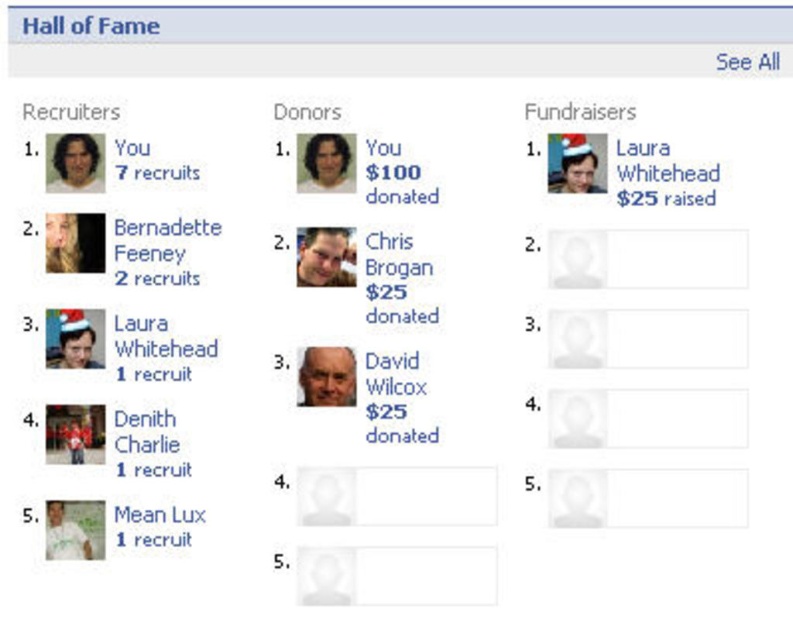
Does matte black face at upper left lie in front of matte plastic face at upper center?

Yes.

Can you confirm if matte black face at upper left is positioned to the right of matte plastic face at upper center?

No, matte black face at upper left is not to the right of matte plastic face at upper center.

Identify the location of matte black face at upper left. (75, 160).

Locate an element on the screen. This screenshot has height=640, width=793. matte black face at upper left is located at coordinates (75, 160).

Is point (83, 332) farther from viewer compared to point (585, 161)?

No, (83, 332) is closer to viewer.

Which of these two, matte black face at center or matte plastic face at upper center, stands shorter?

Standing shorter between the two is matte plastic face at upper center.

Image resolution: width=793 pixels, height=640 pixels. What do you see at coordinates (75, 348) in the screenshot? I see `matte black face at center` at bounding box center [75, 348].

Locate an element on the screen. The width and height of the screenshot is (793, 640). matte black face at center is located at coordinates (75, 348).

Who is positioned more to the left, smooth skin face at center or matte black face at upper center?

smooth skin face at center

Can you confirm if smooth skin face at center is positioned below matte black face at upper center?

Yes, smooth skin face at center is below matte black face at upper center.

What do you see at coordinates (328, 376) in the screenshot? I see `smooth skin face at center` at bounding box center [328, 376].

I want to click on smooth skin face at center, so click(328, 376).